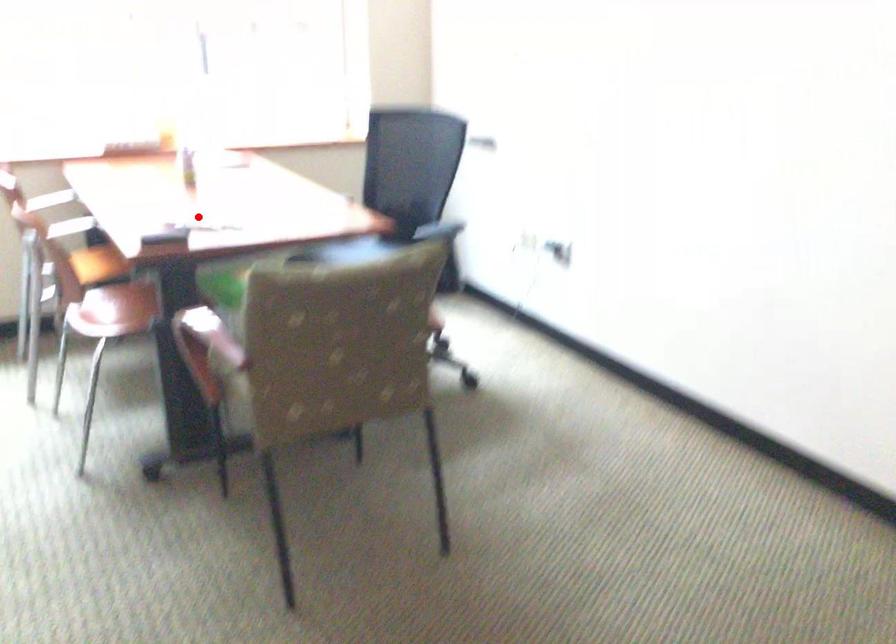
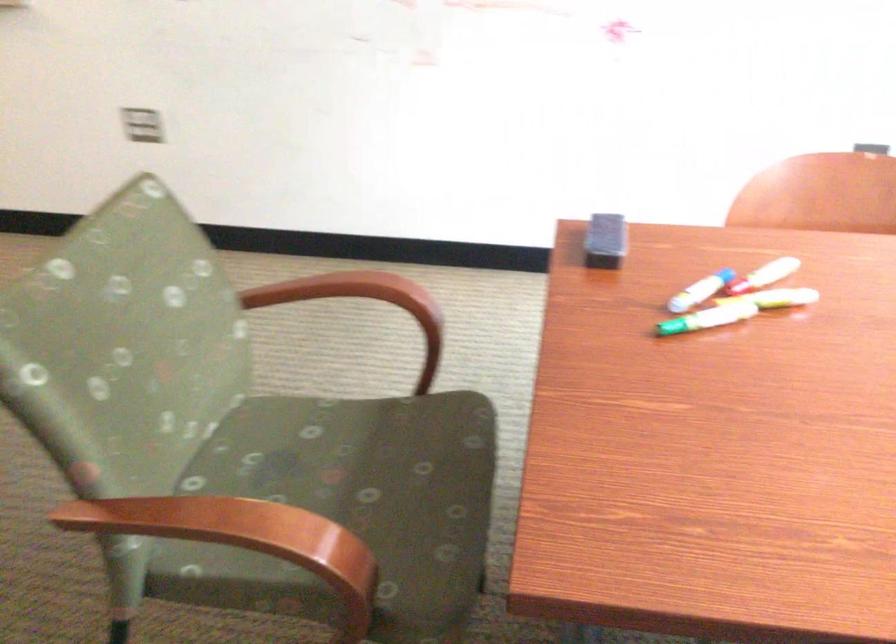
Where in the second image is the point corresponding to the highlighted location from the first image?

(700, 290)